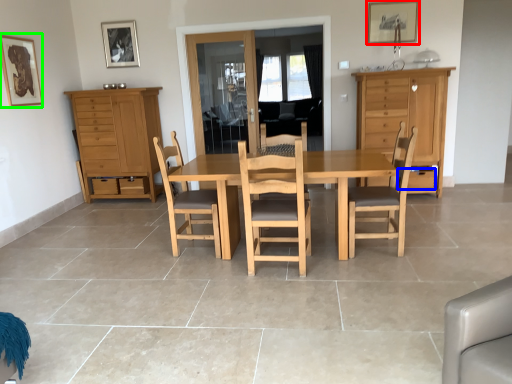
Question: Based on their relative distances, which object is farther from picture frame (highlighted by a red box)? Choose from drawer (highlighted by a blue box) and picture frame (highlighted by a green box).

Choices:
 (A) drawer
 (B) picture frame

Answer: (B)